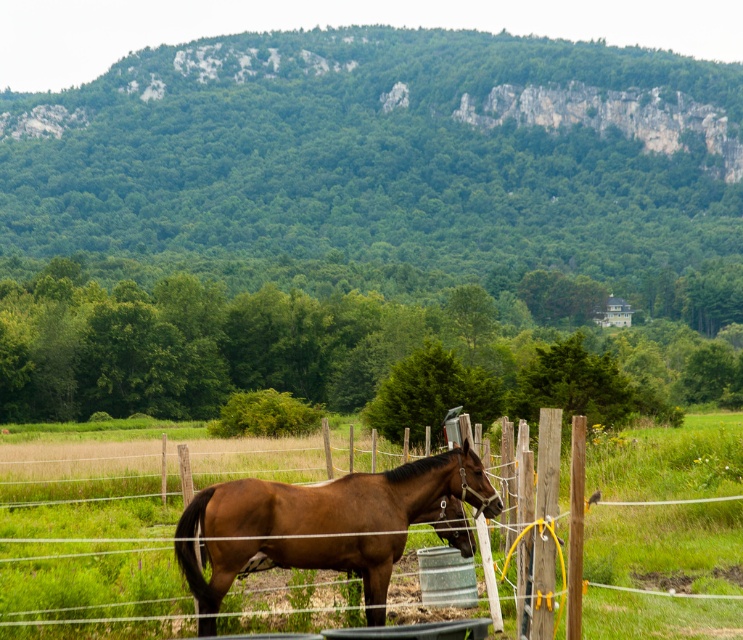
Which is above, wooden post fence at center or brown glossy horse at center?

brown glossy horse at center

Who is lower down, wooden post fence at center or brown glossy horse at center?

wooden post fence at center is below.

Locate an element on the screen. This screenshot has width=743, height=640. wooden post fence at center is located at coordinates (224, 548).

Which is above, green leafy hillside at upper center or brown glossy horse at center?

green leafy hillside at upper center

Who is positioned more to the left, green leafy hillside at upper center or brown glossy horse at center?

green leafy hillside at upper center

This screenshot has height=640, width=743. Find the location of `green leafy hillside at upper center`. green leafy hillside at upper center is located at coordinates (380, 156).

Find the location of a particular element. The image size is (743, 640). green leafy hillside at upper center is located at coordinates (380, 156).

Can you confirm if green leafy hillside at upper center is thinner than wooden post fence at center?

Incorrect, green leafy hillside at upper center's width is not less than wooden post fence at center's.

Which is behind, point (178, 97) or point (240, 556)?

Point (178, 97)

Identify the location of green leafy hillside at upper center. (380, 156).